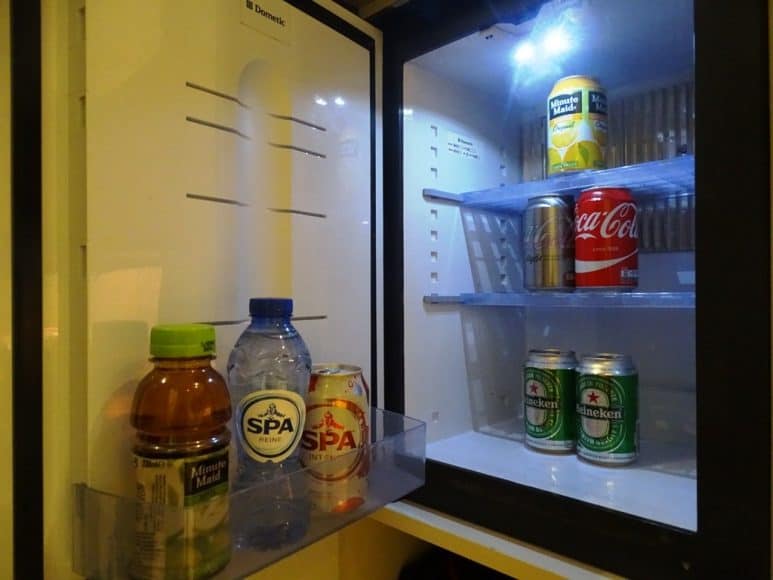
Locate an element on the screen. The width and height of the screenshot is (773, 580). shelf is located at coordinates (430, 532).